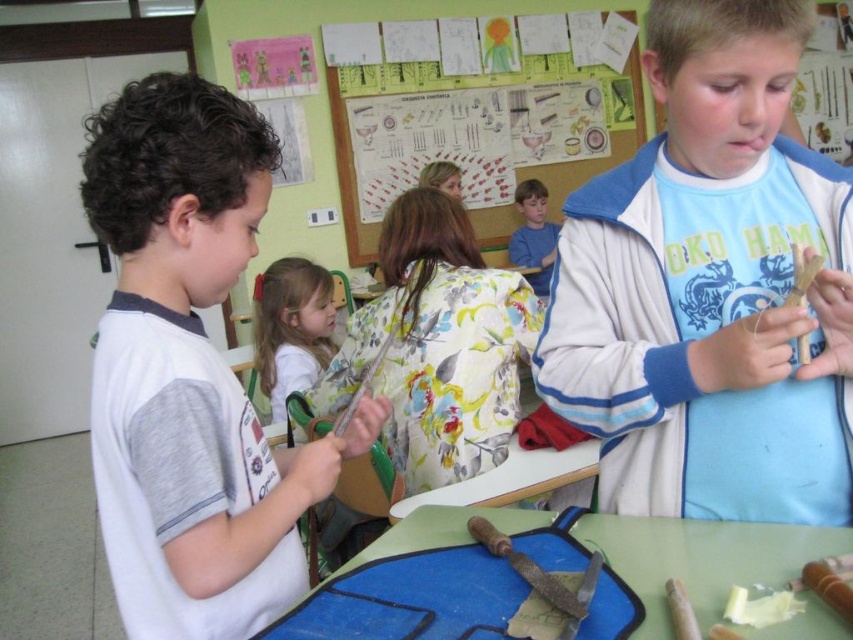
You are a teacher in the classroom and want to place both the wooden stick at right and the wooden posterboard at upper center on a shelf. Which object will require more shelf space?

The wooden posterboard at upper center requires more shelf space because it occupies more space than the wooden stick at right.

From the picture: You are a teacher standing at the front of the classroom. You want to hand out a worksheet to the student wearing the white matte shirt at left and then to the wooden posterboard at upper center. Is the distance between them sufficient for you to walk comfortably between them without needing to move any furniture?

The distance between the white matte shirt at left and the wooden posterboard at upper center is 3.78 meters, which is more than enough space for a teacher to walk comfortably between them without needing to move any furniture.

In the scene shown: You are a teacher in the classroom and want to locate the point at coordinates (190, 371). Which object is this point located on?

The point at coordinates (190, 371) is located on the white matte shirt at left.